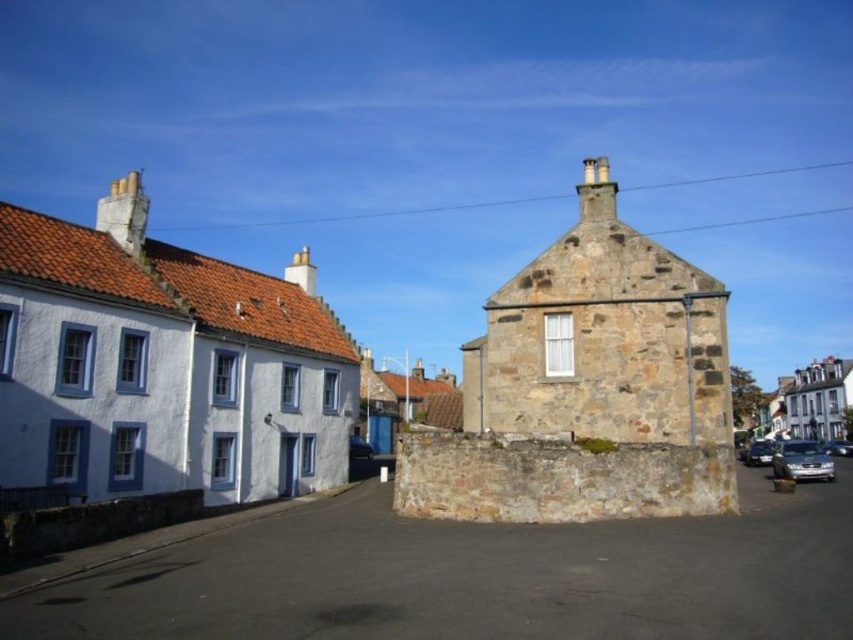
You are standing on the street and want to take a photo of both the brown stone chimney at upper left and the satin silver sedan at lower right. Which object should you focus on first to ensure both are in the frame?

You should focus on the brown stone chimney at upper left first because it is closer to the viewer than the satin silver sedan at lower right, so adjusting the camera to include the closer object will help ensure the farther one is also in the frame.

You are standing at the point marked by coordinates point [157,380] in the image. What building are you facing?

The point [157,380] corresponds to the stone building at center, so you are facing the stone building at center.